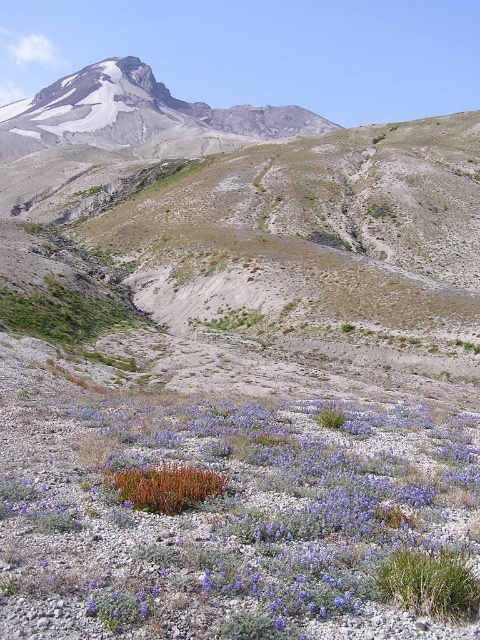
Question: Where is purple soft-textured flowers at center located in relation to snowy rocky peak at upper center in the image?

Choices:
 (A) above
 (B) below

Answer: (B)

Question: Is snowy rocky peak at upper center closer to the viewer compared to green grass at lower right?

Choices:
 (A) no
 (B) yes

Answer: (A)

Question: Which point is farther from the camera taking this photo?

Choices:
 (A) (352, 580)
 (B) (123, 99)
 (C) (396, 548)

Answer: (B)

Question: Which object appears closest to the camera in this image?

Choices:
 (A) snowy rocky peak at upper center
 (B) purple soft-textured flowers at center
 (C) green grass at lower right

Answer: (B)

Question: Which point appears farthest from the camera in this image?

Choices:
 (A) (475, 595)
 (B) (19, 516)
 (C) (137, 118)

Answer: (C)

Question: Does purple soft-textured flowers at center appear over green grass at lower right?

Choices:
 (A) yes
 (B) no

Answer: (A)